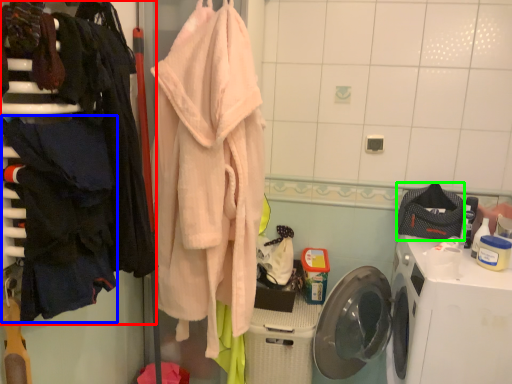
Question: Considering the real-world distances, which object is farthest from closet (highlighted by a red box)? clothing (highlighted by a blue box) or clothing (highlighted by a green box)?

Choices:
 (A) clothing
 (B) clothing

Answer: (B)